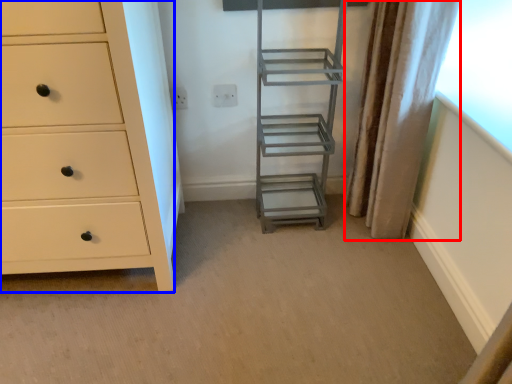
Question: Among these objects, which one is farthest to the camera, curtain (highlighted by a red box) or chest of drawers (highlighted by a blue box)?

Choices:
 (A) curtain
 (B) chest of drawers

Answer: (A)